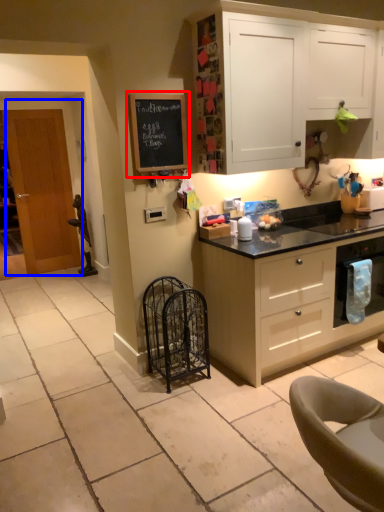
Question: Which point is closer to the camera, bulletin board (highlighted by a red box) or door (highlighted by a blue box)?

Choices:
 (A) bulletin board
 (B) door

Answer: (A)